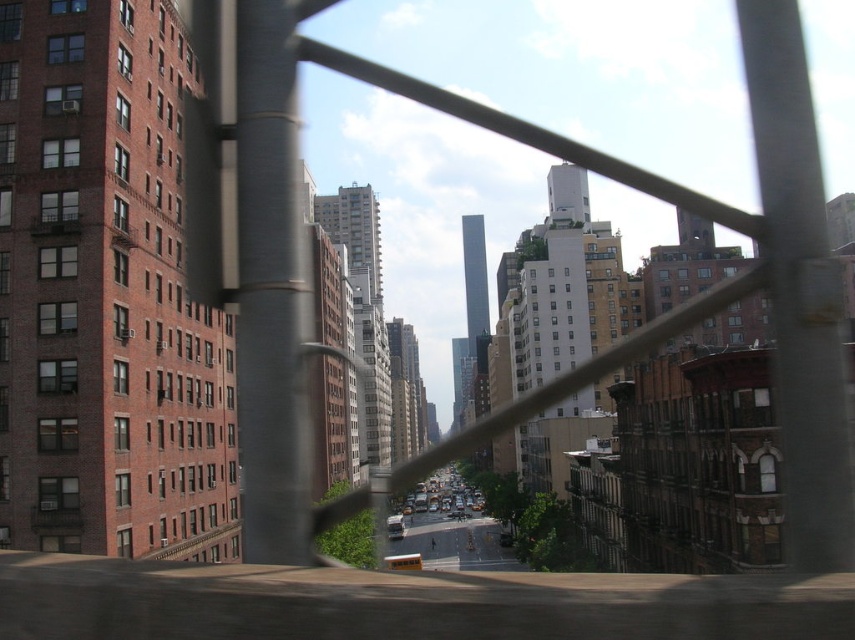
Question: Which of the following is the farthest from the observer?

Choices:
 (A) (261, 531)
 (B) (783, 196)

Answer: (A)

Question: Does metallic gray pole at right have a larger size compared to smooth metallic pole at center?

Choices:
 (A) no
 (B) yes

Answer: (A)

Question: From the image, what is the correct spatial relationship of metallic gray pole at right in relation to smooth metallic pole at center?

Choices:
 (A) left
 (B) right

Answer: (B)

Question: Among these points, which one is nearest to the camera?

Choices:
 (A) (800, 476)
 (B) (272, 304)

Answer: (A)

Question: Can you confirm if metallic gray pole at right is smaller than smooth metallic pole at center?

Choices:
 (A) no
 (B) yes

Answer: (B)